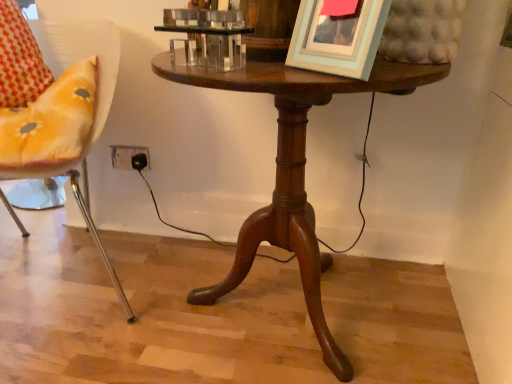
This screenshot has width=512, height=384. Find the location of `light blue matte picture frame at upper right`. light blue matte picture frame at upper right is located at coordinates (338, 36).

Identify the location of mahogany wood table at center. (293, 170).

Considering the points (24, 109) and (393, 76), which point is behind, point (24, 109) or point (393, 76)?

The point (24, 109) is more distant.

Considering the sizes of objects metallic yellow chair at left and mahogany wood table at center in the image provided, who is smaller, metallic yellow chair at left or mahogany wood table at center?

Smaller between the two is mahogany wood table at center.

Is metallic yellow chair at left positioned with its back to mahogany wood table at center?

That's not correct — metallic yellow chair at left is not looking away from mahogany wood table at center.

From a real-world perspective, which object stands above the other?

In real-world perspective, metallic yellow chair at left is above.

Is light blue matte picture frame at upper right spatially inside metallic yellow chair at left, or outside of it?

light blue matte picture frame at upper right lies outside metallic yellow chair at left.

Is light blue matte picture frame at upper right taller or shorter than metallic yellow chair at left?

Clearly, light blue matte picture frame at upper right is shorter compared to metallic yellow chair at left.

Is light blue matte picture frame at upper right next to metallic yellow chair at left?

No, light blue matte picture frame at upper right is not in contact with metallic yellow chair at left.

Between point (343, 37) and point (319, 252), which one is positioned in front?

Point (343, 37)

Is light blue matte picture frame at upper right oriented away from mahogany wood table at center?

light blue matte picture frame at upper right is not turned away from mahogany wood table at center.

Is light blue matte picture frame at upper right inside the boundaries of mahogany wood table at center, or outside?

light blue matte picture frame at upper right is not inside mahogany wood table at center, it's outside.

From the image's perspective, is light blue matte picture frame at upper right over mahogany wood table at center?

Yes, from the image's perspective, light blue matte picture frame at upper right is on top of mahogany wood table at center.

Considering the points (39, 149) and (302, 60), which point is in front, point (39, 149) or point (302, 60)?

Positioned in front is point (302, 60).

Is metallic yellow chair at left oriented towards light blue matte picture frame at upper right?

No.

Considering the sizes of objects metallic yellow chair at left and light blue matte picture frame at upper right in the image provided, who is taller, metallic yellow chair at left or light blue matte picture frame at upper right?

metallic yellow chair at left is taller.

Is metallic yellow chair at left located outside light blue matte picture frame at upper right?

metallic yellow chair at left lies outside light blue matte picture frame at upper right's area.

Which is in front, point (326, 324) or point (344, 1)?

The point (344, 1) is more forward.

Measure the distance from mahogany wood table at center to light blue matte picture frame at upper right.

9.35 inches.

Is mahogany wood table at center spatially inside light blue matte picture frame at upper right, or outside of it?

mahogany wood table at center is located beyond the bounds of light blue matte picture frame at upper right.

Looking at the image, does mahogany wood table at center seem bigger or smaller compared to light blue matte picture frame at upper right?

In the image, mahogany wood table at center appears to be larger than light blue matte picture frame at upper right.

Which is more to the right, mahogany wood table at center or metallic yellow chair at left?

mahogany wood table at center is more to the right.

Is mahogany wood table at center located outside metallic yellow chair at left?

Yes, mahogany wood table at center is outside of metallic yellow chair at left.

Is metallic yellow chair at left at the back of mahogany wood table at center?

No, metallic yellow chair at left is not at the back of mahogany wood table at center.

Considering the relative sizes of mahogany wood table at center and metallic yellow chair at left in the image provided, is mahogany wood table at center bigger than metallic yellow chair at left?

No, mahogany wood table at center is not bigger than metallic yellow chair at left.

Identify the location of table in front of the metallic yellow chair at left. The height and width of the screenshot is (384, 512). (293, 170).

The height and width of the screenshot is (384, 512). I want to click on picture frame above the metallic yellow chair at left (from a real-world perspective), so click(338, 36).

Estimate the real-world distances between objects in this image. Which object is closer to mahogany wood table at center, metallic yellow chair at left or light blue matte picture frame at upper right?

light blue matte picture frame at upper right is closer to mahogany wood table at center.

Which object lies nearer to the anchor point metallic yellow chair at left, light blue matte picture frame at upper right or mahogany wood table at center?

mahogany wood table at center lies closer to metallic yellow chair at left than the other object.

From the image, which object appears to be nearer to light blue matte picture frame at upper right, metallic yellow chair at left or mahogany wood table at center?

mahogany wood table at center.

When comparing their distances from metallic yellow chair at left, does mahogany wood table at center or light blue matte picture frame at upper right seem further?

Among the two, light blue matte picture frame at upper right is located further to metallic yellow chair at left.

From the image, which object appears to be farther from mahogany wood table at center, light blue matte picture frame at upper right or metallic yellow chair at left?

Based on the image, metallic yellow chair at left appears to be further to mahogany wood table at center.

From the image, which object appears to be nearer to light blue matte picture frame at upper right, mahogany wood table at center or metallic yellow chair at left?

The object closer to light blue matte picture frame at upper right is mahogany wood table at center.

You are a GUI agent. You are given a task and a screenshot of the screen. Output one action in this format:
    pyautogui.click(x=<x>, y=<y>)
    Task: Click on the table between metallic yellow chair at left and light blue matte picture frame at upper right in the horizontal direction
    
    Given the screenshot: What is the action you would take?
    pyautogui.click(x=293, y=170)